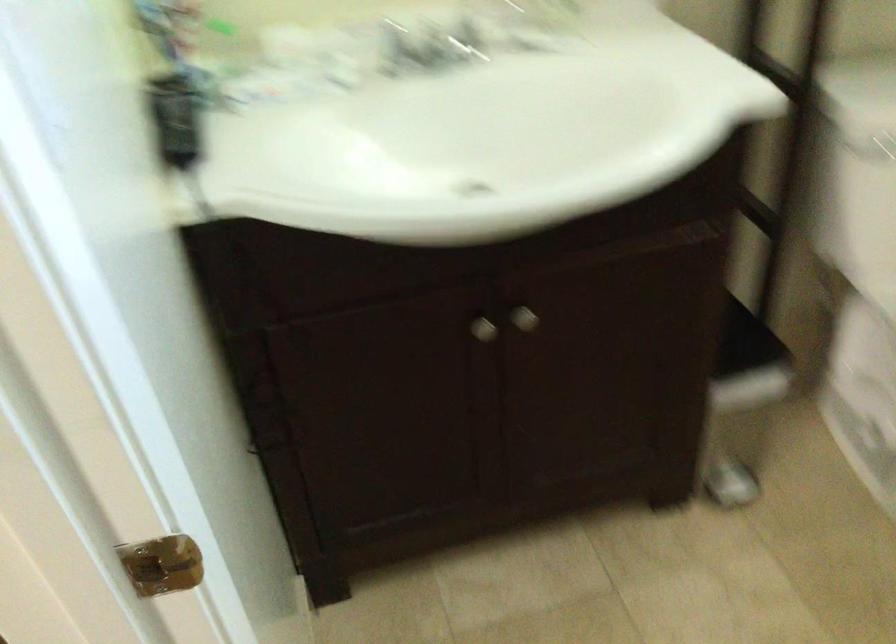
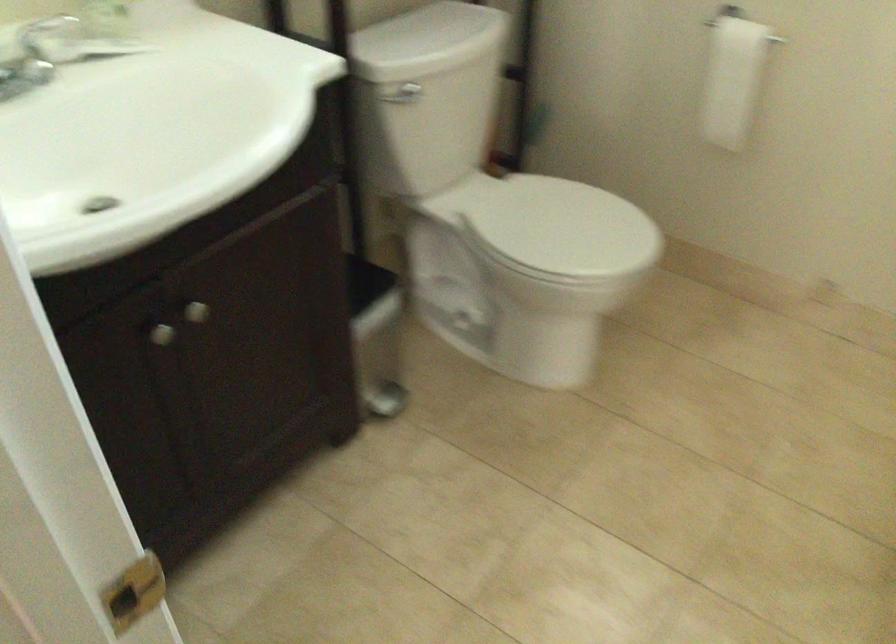
Locate, in the second image, the point that corresponds to (519,314) in the first image.

(195, 312)